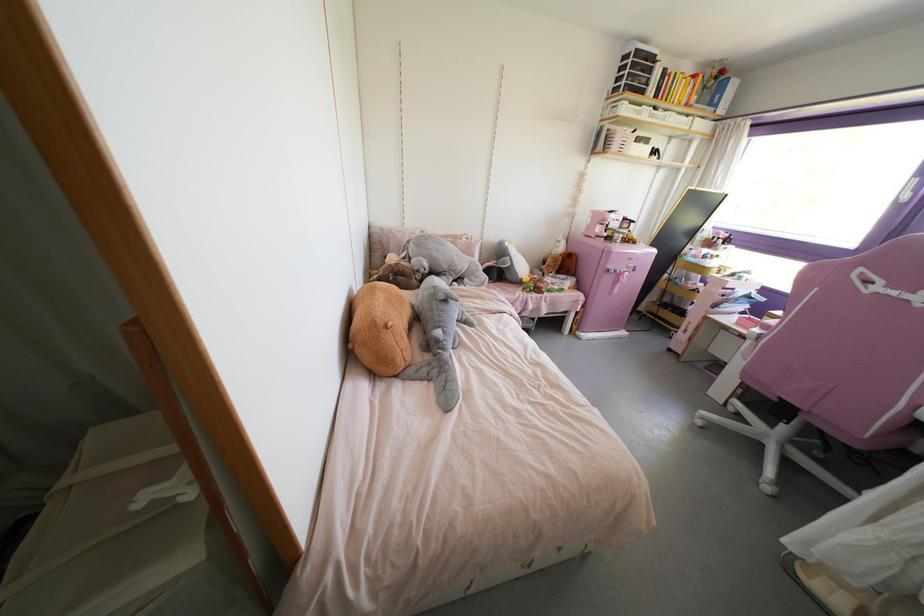
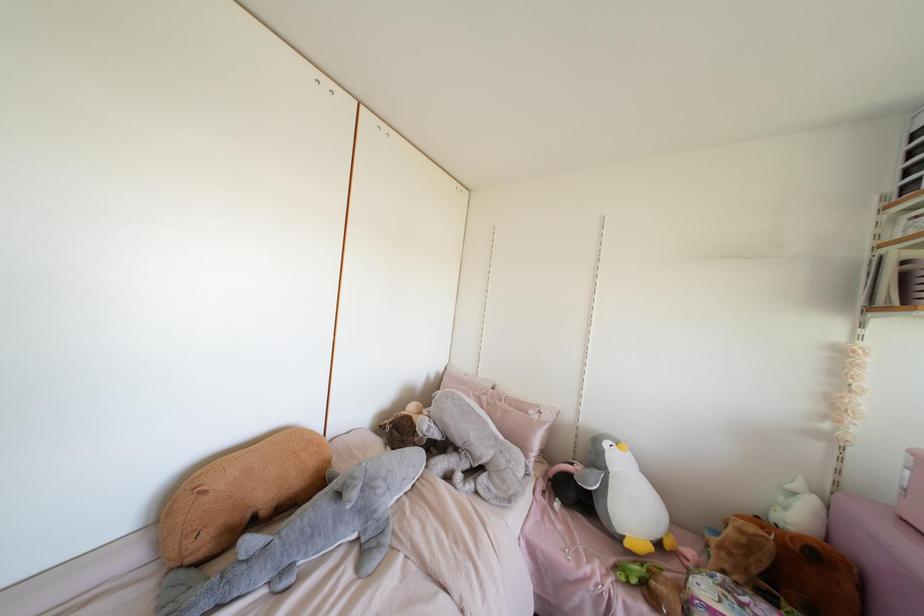
Locate, in the second image, the point that corresponds to the point at 523,280 in the first image.

(626, 544)